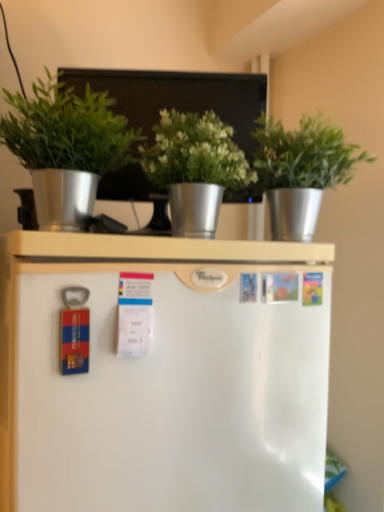
The height and width of the screenshot is (512, 384). What are the coordinates of `metallic silver pot at upper center, which is the 3th houseplant from left to right` in the screenshot? It's located at (300, 170).

What is the approximate width of metallic silver bulletin board at upper center?

metallic silver bulletin board at upper center is 12.32 centimeters wide.

Locate an element on the screen. green matte plant at upper left, arranged as the 1th houseplant when viewed from the left is located at coordinates (66, 148).

This screenshot has width=384, height=512. In order to click on green metallic pot at center, which is the 2th houseplant from right to left in this screenshot , I will do `click(195, 168)`.

Could you tell me if green matte plant at upper left, arranged as the 1th houseplant when viewed from the left, is facing metallic silver pot at upper center, which is the 3th houseplant from left to right?

No, green matte plant at upper left, arranged as the 1th houseplant when viewed from the left, is not aimed at metallic silver pot at upper center, which is the 3th houseplant from left to right.

Considering the positions of points (101, 137) and (323, 174), is point (101, 137) farther from camera compared to point (323, 174)?

No, (101, 137) is closer to viewer.

Which of these two, green matte plant at upper left, the 3th houseplant when ordered from right to left, or metallic silver pot at upper center, which is the 3th houseplant from left to right, is smaller?

green matte plant at upper left, the 3th houseplant when ordered from right to left, is smaller.

Is metallic silver bulletin board at upper center smaller than green matte plant at upper left, arranged as the 1th houseplant when viewed from the left?

No, metallic silver bulletin board at upper center is not smaller than green matte plant at upper left, arranged as the 1th houseplant when viewed from the left.

Can you confirm if metallic silver bulletin board at upper center is positioned to the left of green matte plant at upper left, arranged as the 1th houseplant when viewed from the left?

In fact, metallic silver bulletin board at upper center is to the right of green matte plant at upper left, arranged as the 1th houseplant when viewed from the left.

Looking at this image, from the image's perspective, which is below, metallic silver bulletin board at upper center or green matte plant at upper left, arranged as the 1th houseplant when viewed from the left?

green matte plant at upper left, arranged as the 1th houseplant when viewed from the left.

Is metallic silver bulletin board at upper center wider or thinner than green matte plant at upper left, arranged as the 1th houseplant when viewed from the left?

Clearly, metallic silver bulletin board at upper center has less width compared to green matte plant at upper left, arranged as the 1th houseplant when viewed from the left.

Choose the correct answer: Is metallic silver bulletin board at upper center inside green metallic pot at center, which is the 2th houseplant from right to left, or outside it?

metallic silver bulletin board at upper center is not inside green metallic pot at center, which is the 2th houseplant from right to left, it's outside.

Is point (239, 140) closer or farther from the camera than point (193, 132)?

Point (239, 140) appears to be farther away from the viewer than point (193, 132).

Is metallic silver bulletin board at upper center at the back of green matte plant at upper left, arranged as the 1th houseplant when viewed from the left?

That's not correct — green matte plant at upper left, arranged as the 1th houseplant when viewed from the left, is not looking away from metallic silver bulletin board at upper center.

Based on the photo, which of these two, green matte plant at upper left, the 3th houseplant when ordered from right to left, or metallic silver bulletin board at upper center, is thinner?

With smaller width is metallic silver bulletin board at upper center.

Is green matte plant at upper left, arranged as the 1th houseplant when viewed from the left, positioned behind metallic silver bulletin board at upper center?

No, the depth of green matte plant at upper left, arranged as the 1th houseplant when viewed from the left, is less than that of metallic silver bulletin board at upper center.

From a real-world perspective, which object rests below the other?

From a 3D spatial view, green matte plant at upper left, the 3th houseplant when ordered from right to left, is below.

In terms of height, does metallic silver bulletin board at upper center look taller or shorter compared to metallic silver pot at upper center, which is the 1th houseplant in right-to-left order?

metallic silver bulletin board at upper center is taller than metallic silver pot at upper center, which is the 1th houseplant in right-to-left order.

Is metallic silver bulletin board at upper center bigger or smaller than metallic silver pot at upper center, which is the 3th houseplant from left to right?

In the image, metallic silver bulletin board at upper center appears to be larger than metallic silver pot at upper center, which is the 3th houseplant from left to right.

From a real-world perspective, starting from the metallic silver bulletin board at upper center, which houseplant is the 1st one below it? Please provide its 2D coordinates.

[(300, 170)]

Looking at this image, is metallic silver bulletin board at upper center not within metallic silver pot at upper center, which is the 3th houseplant from left to right?

metallic silver bulletin board at upper center is positioned outside metallic silver pot at upper center, which is the 3th houseplant from left to right.

Is green metallic pot at center, placed as the second houseplant when sorted from left to right, taller than metallic silver bulletin board at upper center?

In fact, green metallic pot at center, placed as the second houseplant when sorted from left to right, may be shorter than metallic silver bulletin board at upper center.

Considering the points (192, 135) and (205, 81), which point is in front, point (192, 135) or point (205, 81)?

Positioned in front is point (192, 135).

How many degrees apart are the facing directions of green metallic pot at center, which is the 2th houseplant from right to left, and metallic silver bulletin board at upper center?

The facing directions of green metallic pot at center, which is the 2th houseplant from right to left, and metallic silver bulletin board at upper center are 27 degrees apart.

Considering the positions of objects green metallic pot at center, which is the 2th houseplant from right to left, and metallic silver bulletin board at upper center in the image provided, who is behind, green metallic pot at center, which is the 2th houseplant from right to left, or metallic silver bulletin board at upper center?

Positioned behind is metallic silver bulletin board at upper center.

Which object is closer to the camera, green metallic pot at center, placed as the second houseplant when sorted from left to right, or metallic silver pot at upper center, which is the 1th houseplant in right-to-left order?

green metallic pot at center, placed as the second houseplant when sorted from left to right.

Can you confirm if green metallic pot at center, placed as the second houseplant when sorted from left to right, is smaller than metallic silver pot at upper center, which is the 3th houseplant from left to right?

Indeed, green metallic pot at center, placed as the second houseplant when sorted from left to right, has a smaller size compared to metallic silver pot at upper center, which is the 3th houseplant from left to right.

Considering the relative sizes of green metallic pot at center, which is the 2th houseplant from right to left, and metallic silver pot at upper center, which is the 1th houseplant in right-to-left order, in the image provided, is green metallic pot at center, which is the 2th houseplant from right to left, wider than metallic silver pot at upper center, which is the 1th houseplant in right-to-left order,?

In fact, green metallic pot at center, which is the 2th houseplant from right to left, might be narrower than metallic silver pot at upper center, which is the 1th houseplant in right-to-left order.

From a real-world perspective, is green metallic pot at center, which is the 2th houseplant from right to left, positioned above or below metallic silver pot at upper center, which is the 1th houseplant in right-to-left order?

Answer: green metallic pot at center, which is the 2th houseplant from right to left, is below metallic silver pot at upper center, which is the 1th houseplant in right-to-left order.

This screenshot has height=512, width=384. Identify the location of the 2nd houseplant in front of the metallic silver pot at upper center, which is the 1th houseplant in right-to-left order. (66, 148).

Locate an element on the screen. houseplant on the left of metallic silver bulletin board at upper center is located at coordinates (66, 148).

Looking at this image, based on their spatial positions, is metallic silver pot at upper center, which is the 1th houseplant in right-to-left order, or green matte plant at upper left, the 3th houseplant when ordered from right to left, further from metallic silver bulletin board at upper center?

green matte plant at upper left, the 3th houseplant when ordered from right to left.

From the image, which object appears to be nearer to metallic silver bulletin board at upper center, green metallic pot at center, placed as the second houseplant when sorted from left to right, or green matte plant at upper left, arranged as the 1th houseplant when viewed from the left?

Among the two, green metallic pot at center, placed as the second houseplant when sorted from left to right, is located nearer to metallic silver bulletin board at upper center.

Looking at the image, which one is located closer to green matte plant at upper left, arranged as the 1th houseplant when viewed from the left, metallic silver bulletin board at upper center or metallic silver pot at upper center, which is the 3th houseplant from left to right?

The object closer to green matte plant at upper left, arranged as the 1th houseplant when viewed from the left, is metallic silver bulletin board at upper center.

Considering their positions, is metallic silver bulletin board at upper center positioned closer to green metallic pot at center, placed as the second houseplant when sorted from left to right, than green matte plant at upper left, the 3th houseplant when ordered from right to left?

The object closer to green metallic pot at center, placed as the second houseplant when sorted from left to right, is green matte plant at upper left, the 3th houseplant when ordered from right to left.

From the image, which object appears to be nearer to green matte plant at upper left, arranged as the 1th houseplant when viewed from the left, metallic silver pot at upper center, which is the 1th houseplant in right-to-left order, or metallic silver bulletin board at upper center?

metallic silver bulletin board at upper center lies closer to green matte plant at upper left, arranged as the 1th houseplant when viewed from the left, than the other object.

From the image, which object appears to be nearer to metallic silver bulletin board at upper center, green matte plant at upper left, arranged as the 1th houseplant when viewed from the left, or metallic silver pot at upper center, which is the 1th houseplant in right-to-left order?

metallic silver pot at upper center, which is the 1th houseplant in right-to-left order.

When comparing their distances from metallic silver pot at upper center, which is the 1th houseplant in right-to-left order, does green metallic pot at center, placed as the second houseplant when sorted from left to right, or metallic silver bulletin board at upper center seem further?

metallic silver bulletin board at upper center is further to metallic silver pot at upper center, which is the 1th houseplant in right-to-left order.

Looking at the image, which one is located closer to metallic silver pot at upper center, which is the 1th houseplant in right-to-left order, metallic silver bulletin board at upper center or green metallic pot at center, placed as the second houseplant when sorted from left to right?

green metallic pot at center, placed as the second houseplant when sorted from left to right, lies closer to metallic silver pot at upper center, which is the 1th houseplant in right-to-left order, than the other object.

Where is `houseplant between green matte plant at upper left, the 3th houseplant when ordered from right to left, and metallic silver pot at upper center, which is the 3th houseplant from left to right, from left to right`? houseplant between green matte plant at upper left, the 3th houseplant when ordered from right to left, and metallic silver pot at upper center, which is the 3th houseplant from left to right, from left to right is located at coordinates (195, 168).

Identify the location of bulletin board located between green matte plant at upper left, the 3th houseplant when ordered from right to left, and metallic silver pot at upper center, which is the 3th houseplant from left to right, in the left-right direction. (178, 97).

Find the location of a particular element. The image size is (384, 512). houseplant between green metallic pot at center, which is the 2th houseplant from right to left, and metallic silver bulletin board at upper center from front to back is located at coordinates (300, 170).